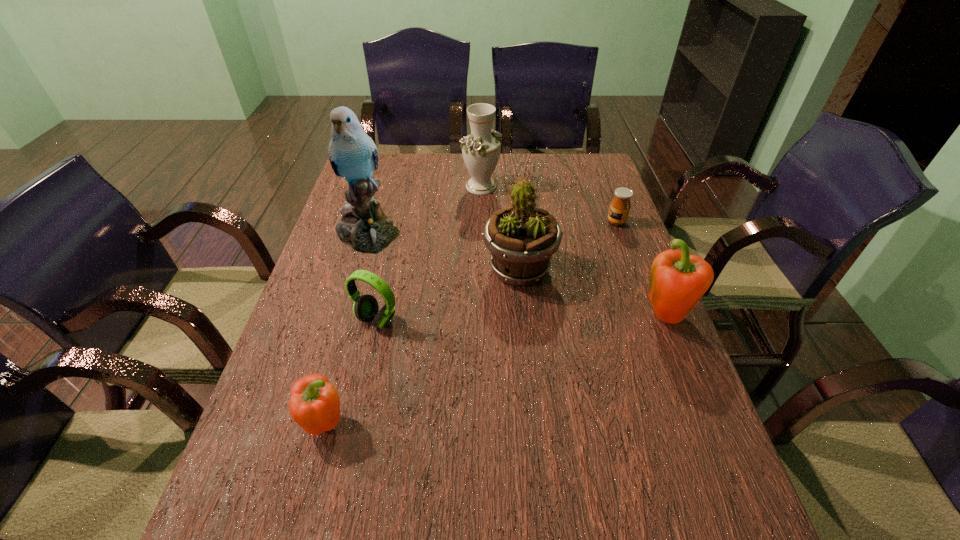
You are a GUI agent. You are given a task and a screenshot of the screen. Output one action in this format:
    pyautogui.click(x=<x>, y=<y>)
    Task: Click on the blank space located 0.150m on the left of the fourth shortest object
    This screenshot has width=960, height=540.
    Given the screenshot: What is the action you would take?
    pyautogui.click(x=578, y=317)

Identify the location of blank space located 0.310m on the right of the farthest object. This screenshot has height=540, width=960. (591, 187).

The image size is (960, 540). I want to click on free space located on the front of the flowerpot, so click(536, 446).

This screenshot has height=540, width=960. I want to click on vacant space located 0.370m on the front-facing side of the honey, so click(488, 222).

Identify the location of vacant space situated on the front-facing side of the honey. (568, 222).

You are a GUI agent. You are given a task and a screenshot of the screen. Output one action in this format:
    pyautogui.click(x=<x>, y=<y>)
    Task: Click on the free spot located on the front-facing side of the honey
    The image size is (960, 540).
    Given the screenshot: What is the action you would take?
    pos(588,222)

I want to click on vacant point located on the face of the parakeet, so click(x=354, y=280).

Identify the location of vacant area located on the front of the headset. (355, 419).

The width and height of the screenshot is (960, 540). Identify the location of object that is at the far edge. (481, 150).

Identify the location of object that is positioned at the near edge. This screenshot has width=960, height=540. (315, 404).